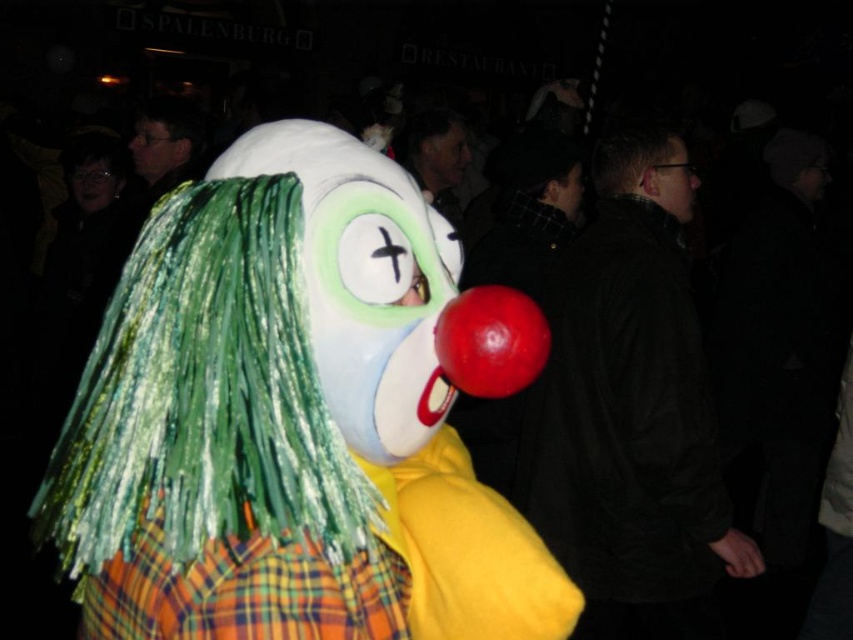
You are standing in front of the clown costume and want to place a sticker on the closest point between point [161,154] and point [91,170]. Which point should you choose?

Point [161,154] is in front of point [91,170], so the closest point to you is point [161,154].